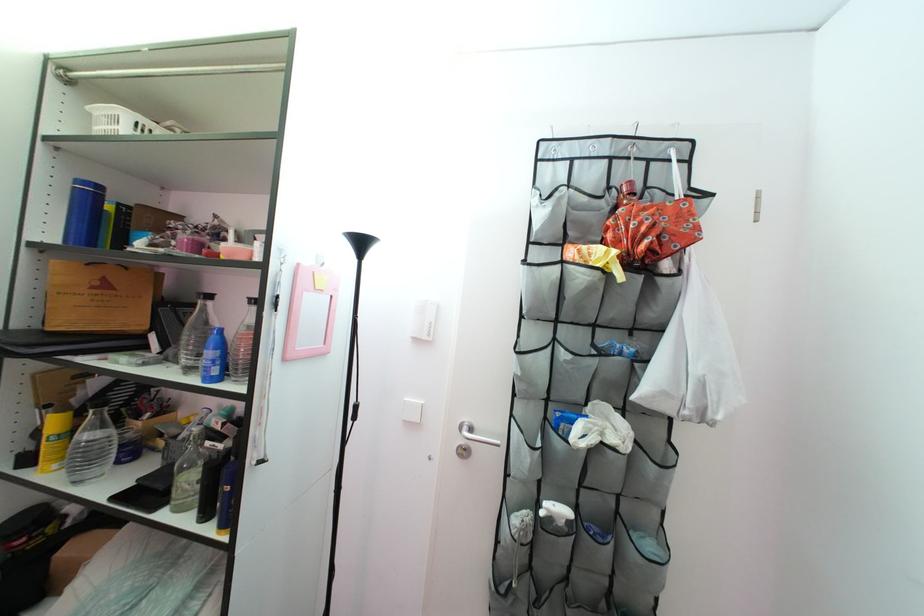
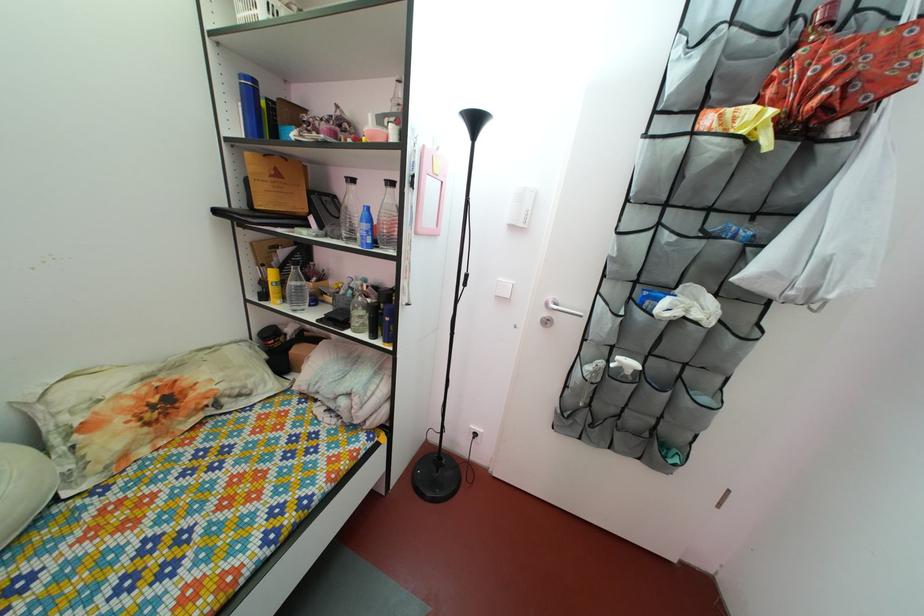
Question: Based on the continuous images, in which direction is the camera rotating? Reply with the corresponding letter.

Choices:
 (A) Left
 (B) Right
 (C) Up
 (D) Down

Answer: (D)